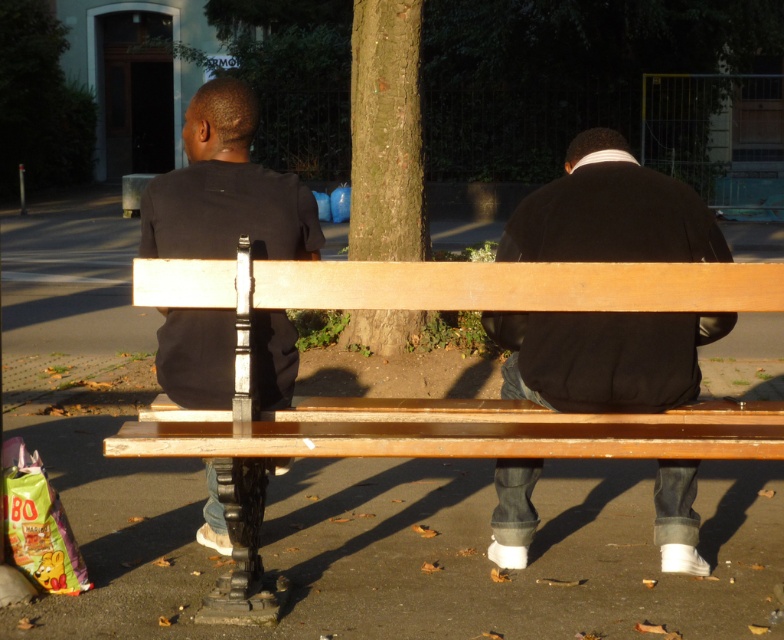
Which is behind, point (165, 221) or point (376, 20)?

Point (376, 20)

I want to click on black matte shirt at left, so click(227, 189).

Who is lower down, matte black jacket at center or green leafy tree at upper left?

matte black jacket at center is below.

Is matte black jacket at center below green leafy tree at upper left?

Yes, matte black jacket at center is below green leafy tree at upper left.

Locate an element on the screen. The height and width of the screenshot is (640, 784). matte black jacket at center is located at coordinates (603, 356).

Locate an element on the screen. The height and width of the screenshot is (640, 784). matte black jacket at center is located at coordinates tap(603, 356).

Who is positioned more to the left, black matte jacket at center or green leafy tree at upper left?

Positioned to the left is green leafy tree at upper left.

Is black matte jacket at center thinner than green leafy tree at upper left?

Indeed, black matte jacket at center has a lesser width compared to green leafy tree at upper left.

The width and height of the screenshot is (784, 640). Describe the element at coordinates (603, 356) in the screenshot. I see `black matte jacket at center` at that location.

What are the coordinates of `black matte jacket at center` in the screenshot? It's located at (603, 356).